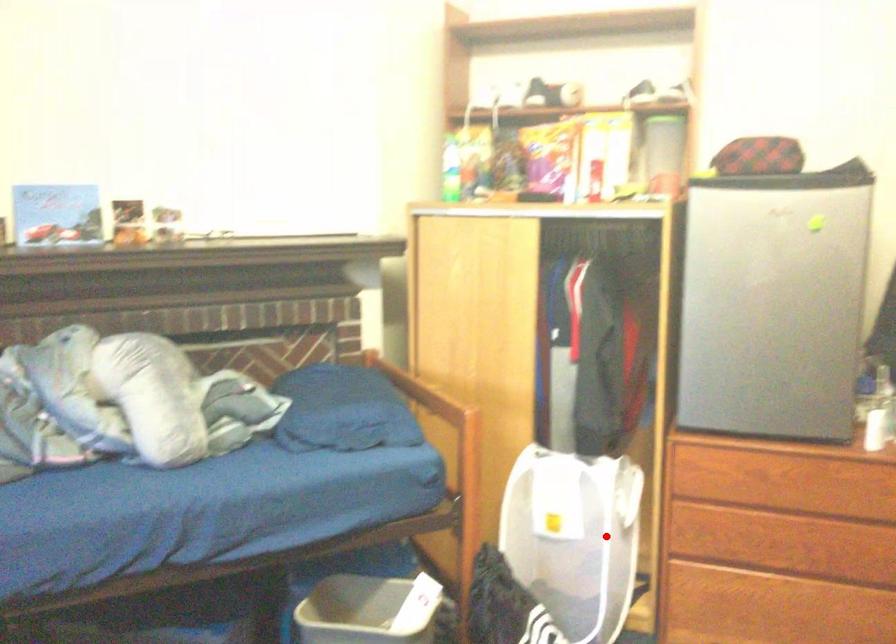
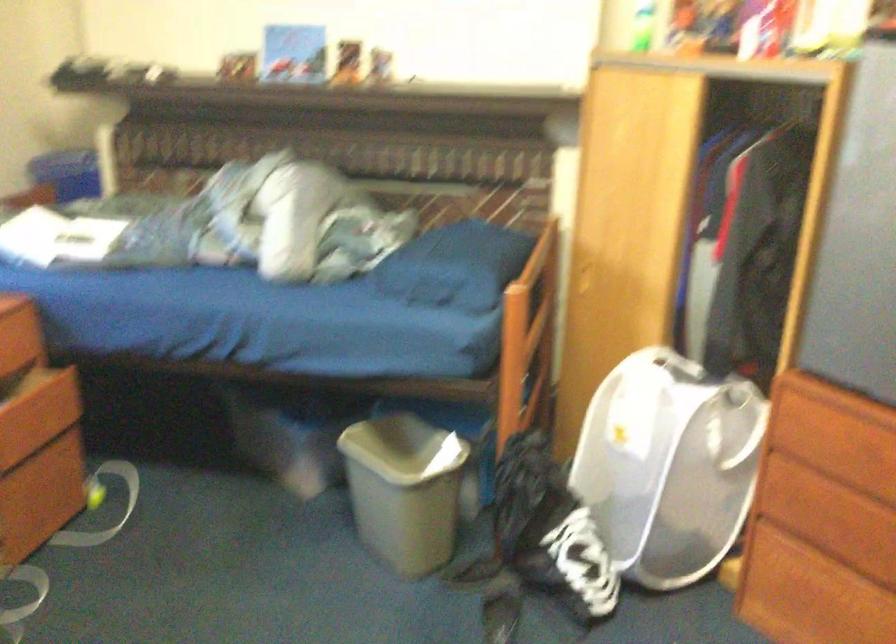
The point at the highlighted location is marked in the first image. Where is the corresponding point in the second image?

(668, 466)